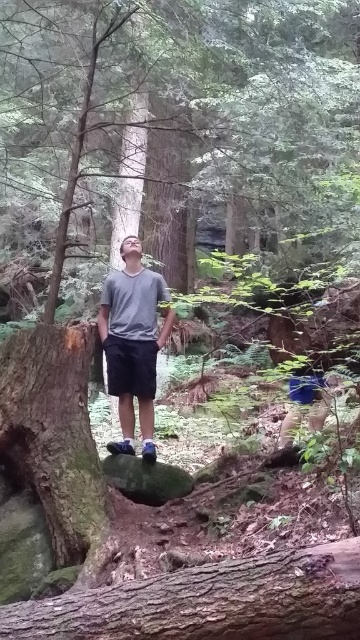
Question: Does brown rough bark tree trunk at lower center have a lesser width compared to gray matte shirt at center?

Choices:
 (A) no
 (B) yes

Answer: (A)

Question: Which of the following is the closest to the observer?

Choices:
 (A) (146, 451)
 (B) (258, 627)
 (C) (78, 428)

Answer: (B)

Question: Where is green rough bark tree at center located in relation to brown rough bark tree trunk at lower center in the image?

Choices:
 (A) left
 (B) right

Answer: (A)

Question: Which object is closer to the camera taking this photo?

Choices:
 (A) smooth brown tree trunk at left
 (B) gray matte shirt at center
 (C) brown rough bark tree trunk at lower center

Answer: (C)

Question: Which object appears farthest from the camera in this image?

Choices:
 (A) smooth brown tree trunk at left
 (B) brown rough bark tree trunk at lower center
 (C) green rough bark tree at center
 (D) gray matte shirt at center

Answer: (D)

Question: Does green rough bark tree at center appear over smooth brown tree trunk at left?

Choices:
 (A) yes
 (B) no

Answer: (A)